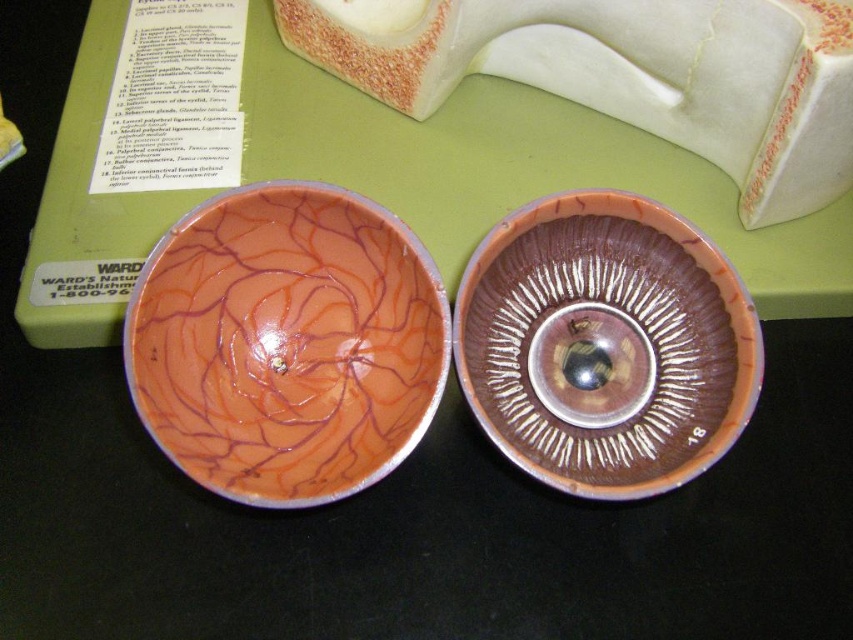
Can you confirm if matte orange bowl at center is shorter than shiny brown bowl at center?

No.

Which is behind, point (379, 394) or point (666, 422)?

Positioned behind is point (666, 422).

At what (x,y) coordinates should I click in order to perform the action: click on matte orange bowl at center. Please return your answer as a coordinate pair (x, y). The width and height of the screenshot is (853, 640). Looking at the image, I should click on (286, 344).